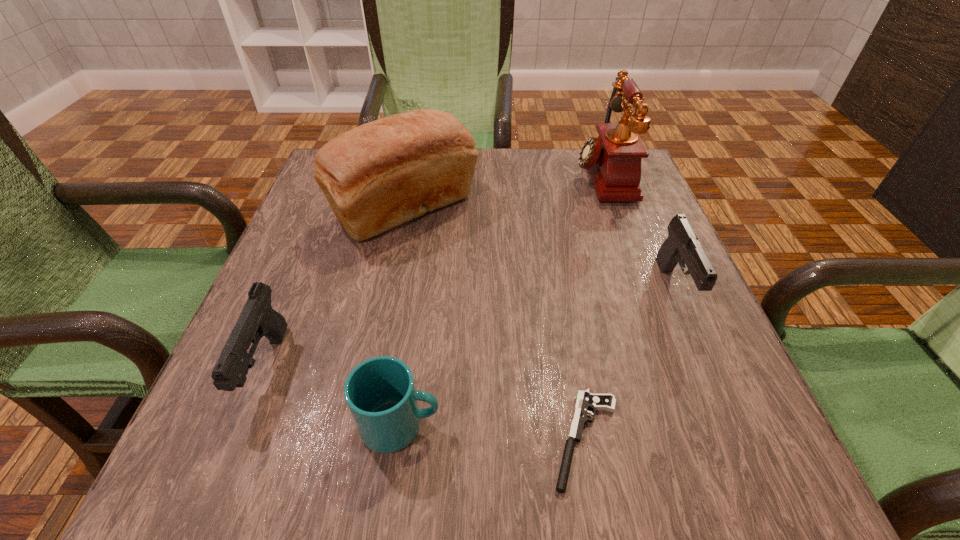
Where is `vacant space that satisfies the following two spatial constraints: 1. on the dial of the telephone; 2. on the front side of the bread`? The height and width of the screenshot is (540, 960). vacant space that satisfies the following two spatial constraints: 1. on the dial of the telephone; 2. on the front side of the bread is located at coordinates (613, 210).